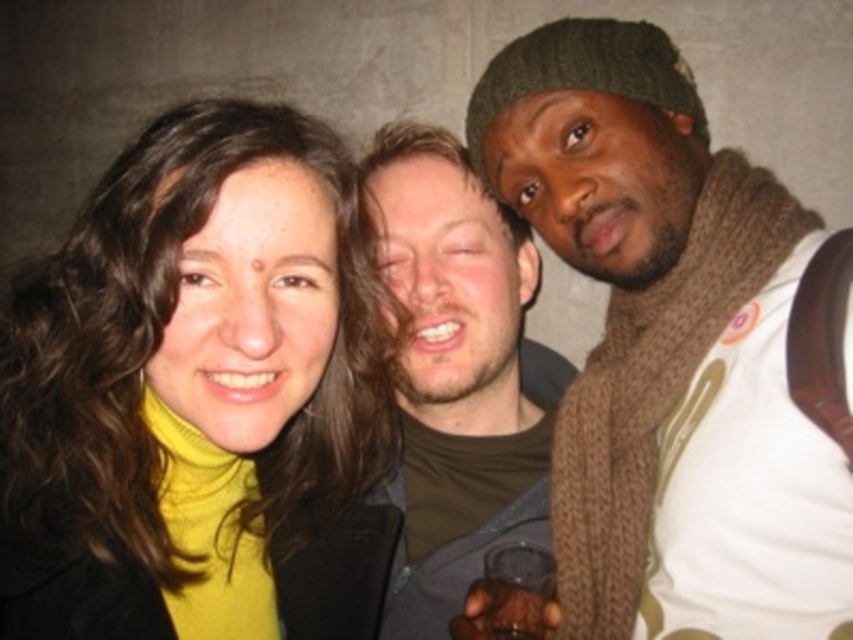
You are a photographer trying to adjust the lighting for a group photo. You notice the brown knitted scarf at right and the matte brown hair at center. Which object requires more light to ensure it stands out in the photo?

The brown knitted scarf at right requires more light because it is bigger than the matte brown hair at center.

You are a photographer trying to adjust the lighting for a group photo. You notice the yellow turtleneck sweater at left and the brown knitted scarf at right. Which object is positioned lower in the image?

The yellow turtleneck sweater at left is located below the brown knitted scarf at right, so it is positioned lower in the image.

Based on the photo, you are taking a photo of the three people in the scene. You want to focus on the person on the right. However, there are two points in the image at coordinates point (125, 410) and point (415, 237). Which point should you avoid focusing on to ensure the person on the right is in focus?

You should avoid focusing on point (125, 410) because it is in front of point (415, 237), so focusing on the closer point would leave the farther point out of focus.